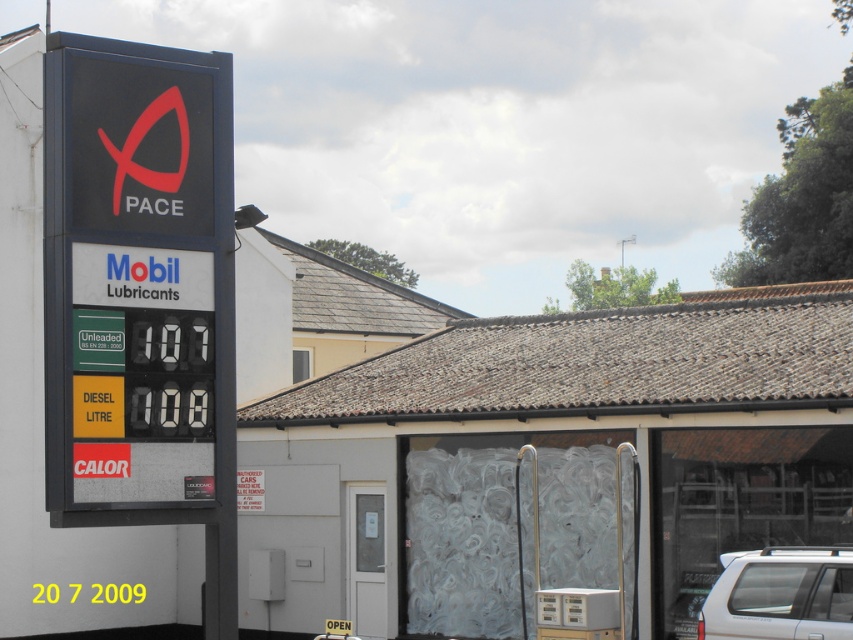
Question: Can you confirm if metallic silver fuel pump at center is wider than white matte suv at lower right?

Choices:
 (A) no
 (B) yes

Answer: (B)

Question: Can you confirm if metallic silver fuel pump at center is wider than white matte suv at lower right?

Choices:
 (A) no
 (B) yes

Answer: (B)

Question: Which point is closer to the camera taking this photo?

Choices:
 (A) (700, 611)
 (B) (674, 534)

Answer: (A)

Question: Does metallic silver fuel pump at center come behind white matte suv at lower right?

Choices:
 (A) no
 (B) yes

Answer: (B)